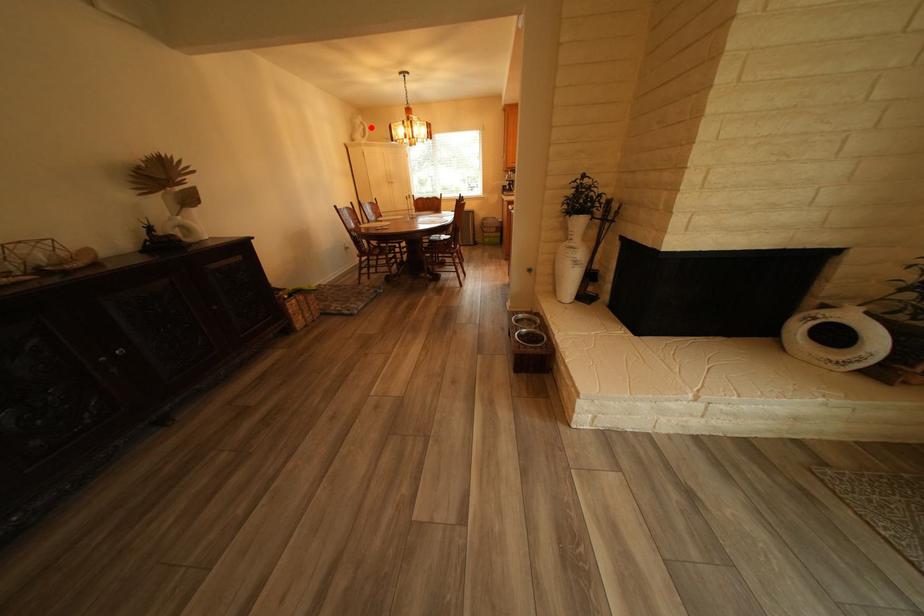
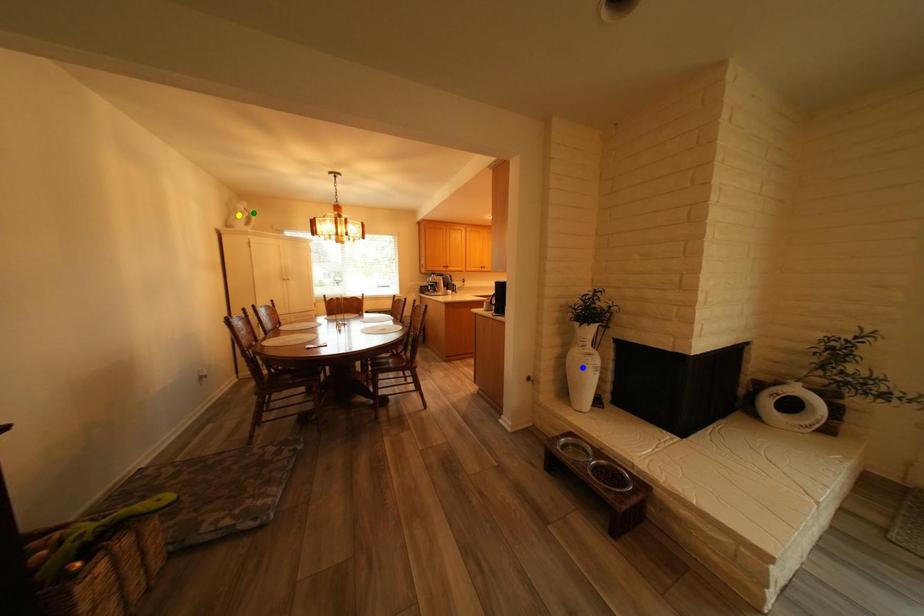
Question: I am providing you with two images of the same scene from different viewpoints. A red point is marked on the first image. You are given multiple points on the second image. Which spot in image 2 lines up with the point in image 1?

Choices:
 (A) yellow point
 (B) blue point
 (C) green point

Answer: (C)